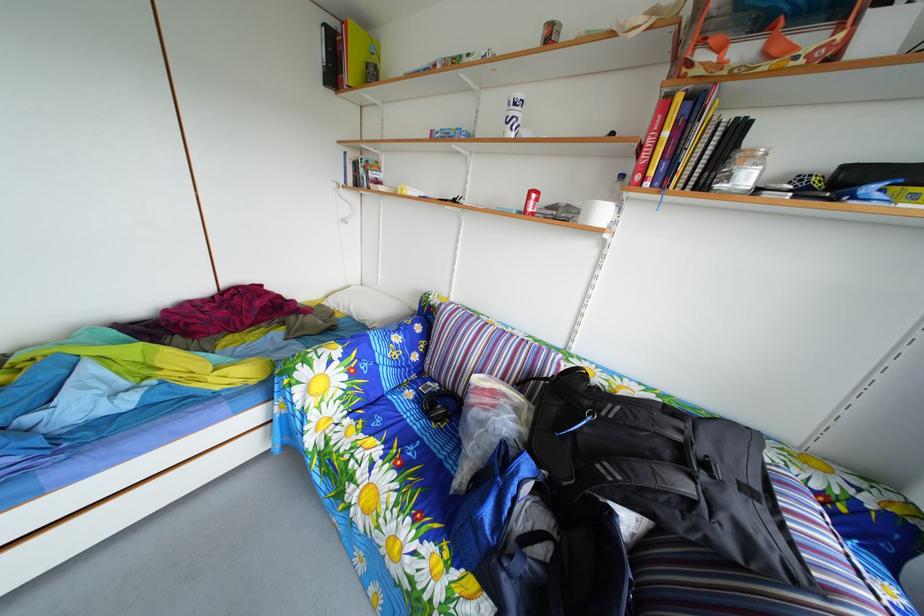
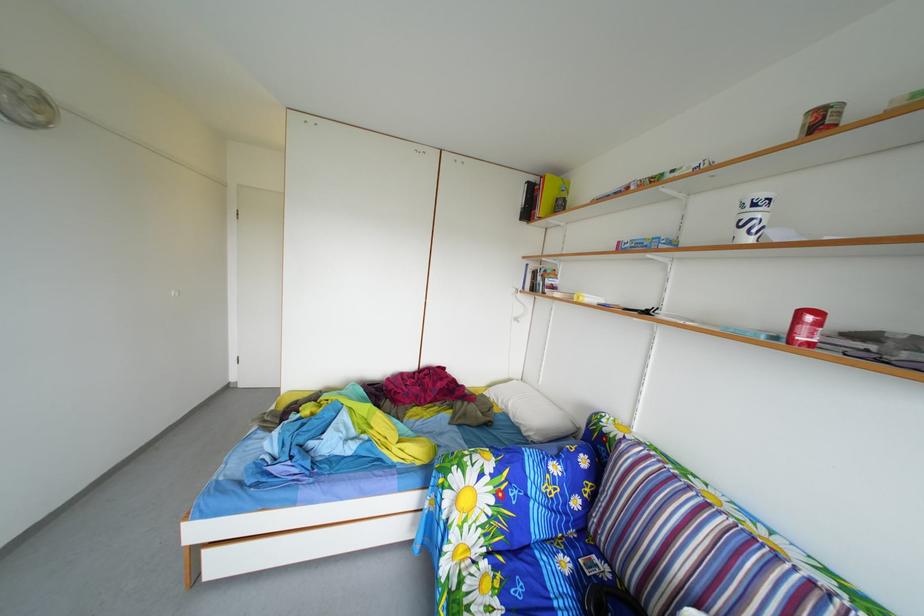
How did the camera likely rotate?

The rotation direction of the camera is left-up.